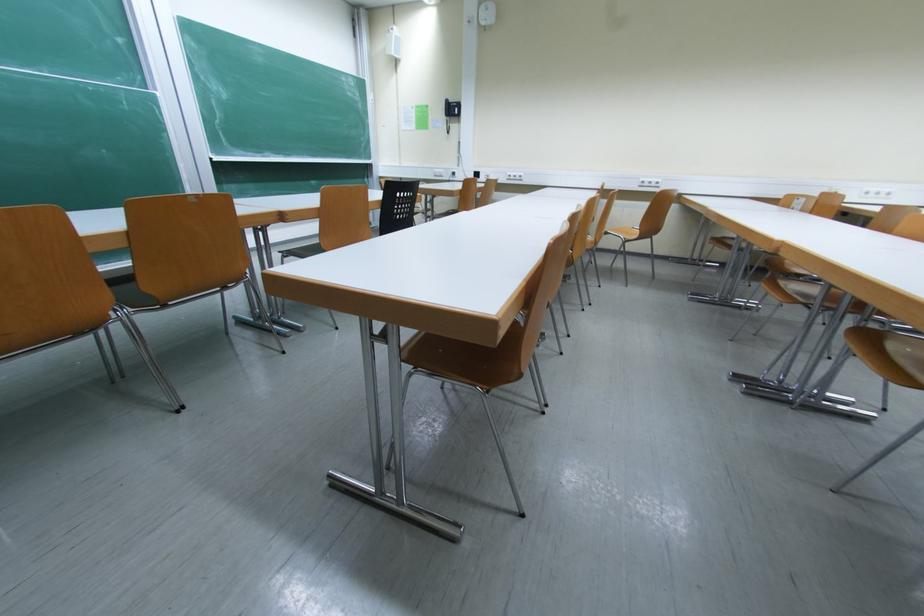
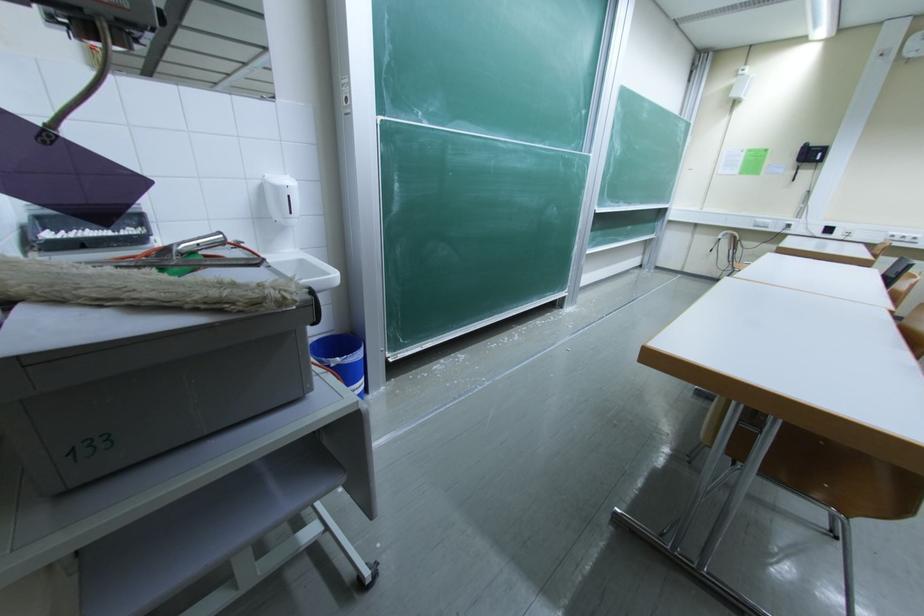
Question: In a continuous first-person perspective shot, in which direction is the camera moving?

Choices:
 (A) Left
 (B) Right
 (C) Forward
 (D) Backward

Answer: (A)